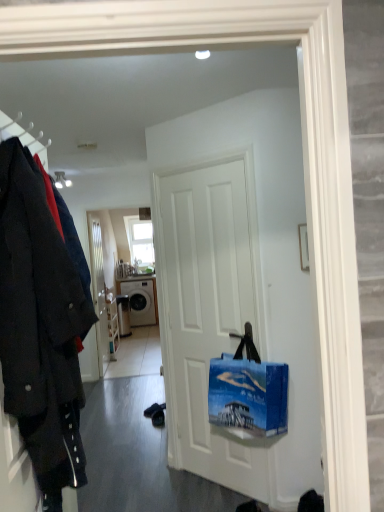
The image size is (384, 512). In order to click on vacant area that lies to the right of white glossy door at center, which is the 2th door from front to back in this screenshot , I will do `click(126, 364)`.